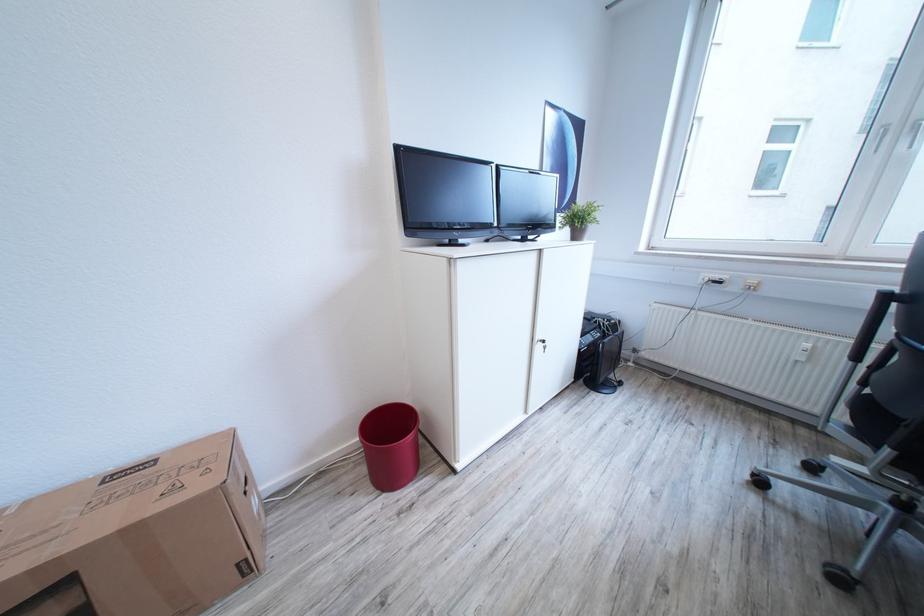
Which object does [138,537] point to?

It refers to a cardboard box.